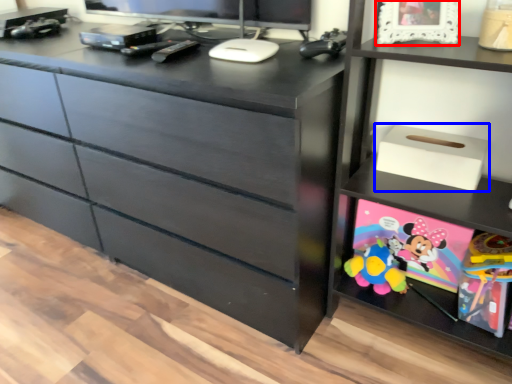
Question: Which object appears closest to the camera in this image, picture frame (highlighted by a red box) or storage box (highlighted by a blue box)?

Choices:
 (A) picture frame
 (B) storage box

Answer: (A)